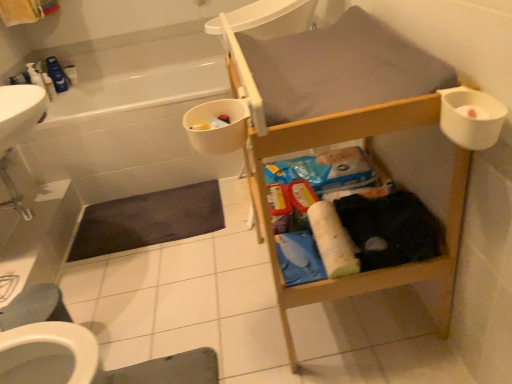
The image size is (512, 384). I want to click on vacant area that lies between white plastic bidet at lower left and dark matte bath mat at lower left, the first bath mat when ordered from top to bottom, so click(130, 277).